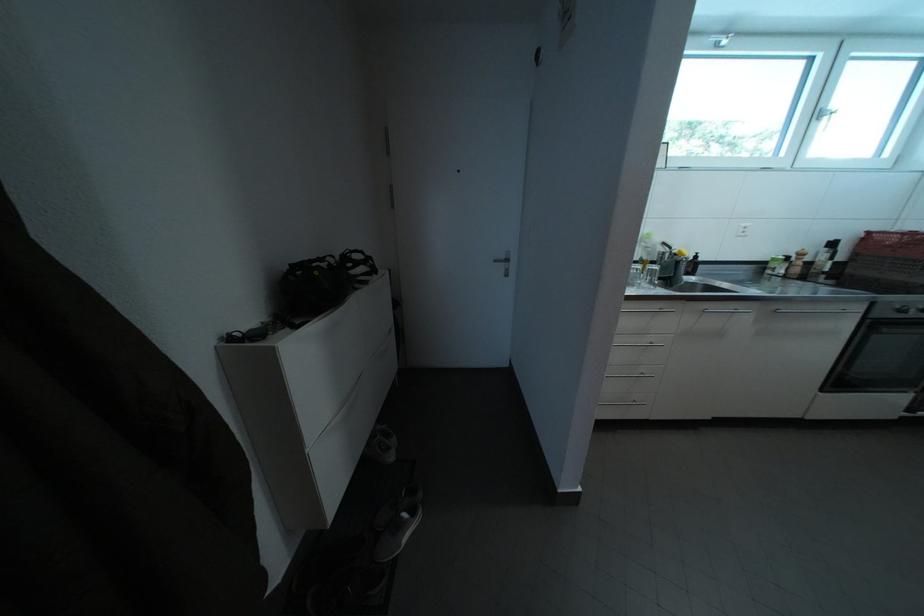
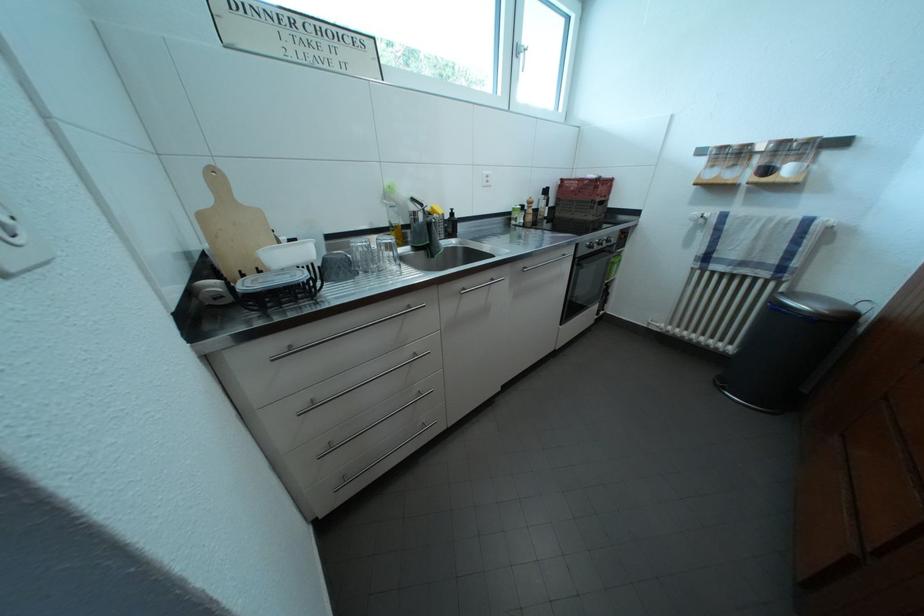
Find the pixel in the second image that matches point 882,310 in the first image.

(587, 251)